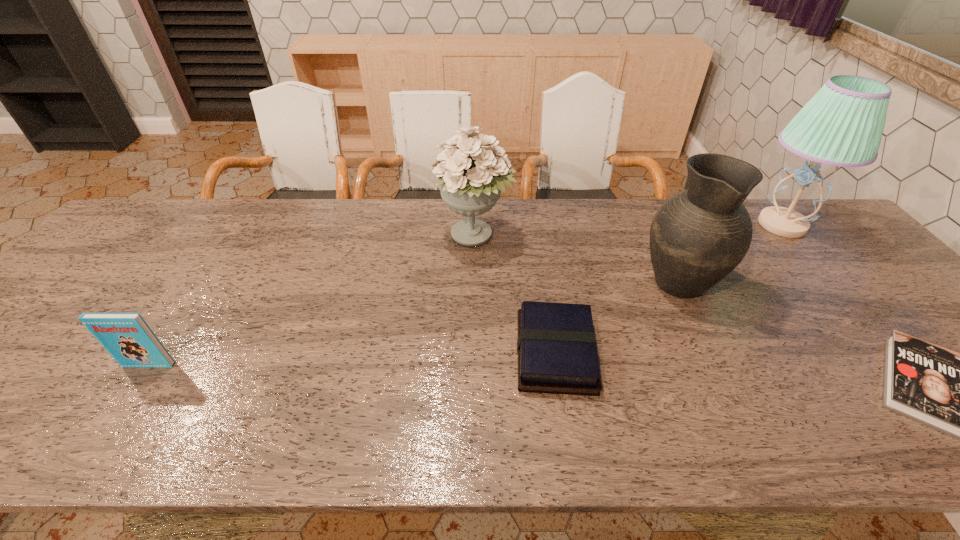
Locate an element on the screen. The height and width of the screenshot is (540, 960). vacant region located 0.250m on the side of the pitcher with the handle is located at coordinates (641, 203).

At what (x,y) coordinates should I click in order to perform the action: click on vacant space located on the side of the pitcher with the handle. Please return your answer as a coordinate pair (x, y). Looking at the image, I should click on (652, 227).

Where is `free space located on the front cover of the tallest book`? free space located on the front cover of the tallest book is located at coordinates (123, 404).

Where is `free space located 0.160m on the right of the second tallest book`? free space located 0.160m on the right of the second tallest book is located at coordinates (665, 353).

At what (x,y) coordinates should I click in order to perform the action: click on lamp situated at the far edge. Please return your answer as a coordinate pair (x, y). This screenshot has width=960, height=540. Looking at the image, I should click on (842, 125).

Locate an element on the screen. bouquet present at the far edge is located at coordinates pos(472,172).

Locate an element on the screen. The width and height of the screenshot is (960, 540). object that is at the right edge is located at coordinates (842, 125).

Where is `object that is at the far right corner`? object that is at the far right corner is located at coordinates (842, 125).

The height and width of the screenshot is (540, 960). Find the location of `vacant space at the far edge of the desktop`. vacant space at the far edge of the desktop is located at coordinates (197, 208).

In order to click on vacant space at the near edge in this screenshot , I will do `click(149, 422)`.